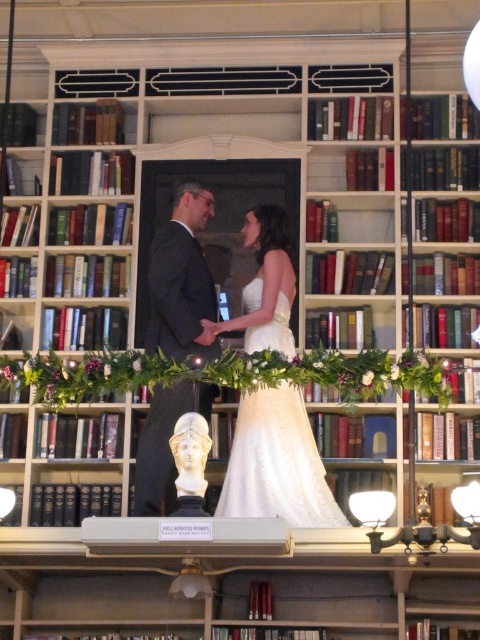
Who is more distant from viewer, (285, 464) or (167, 326)?

Positioned behind is point (167, 326).

Who is more forward, [252,220] or [173,205]?

Positioned in front is point [252,220].

The image size is (480, 640). I want to click on white satin dress at center, so click(276, 464).

Identify the location of white satin dress at center. (276, 464).